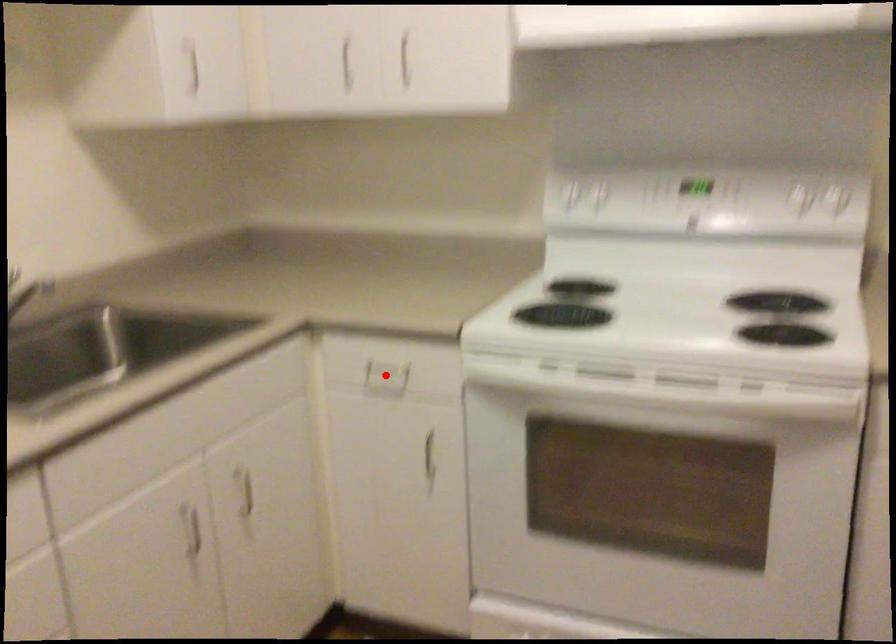
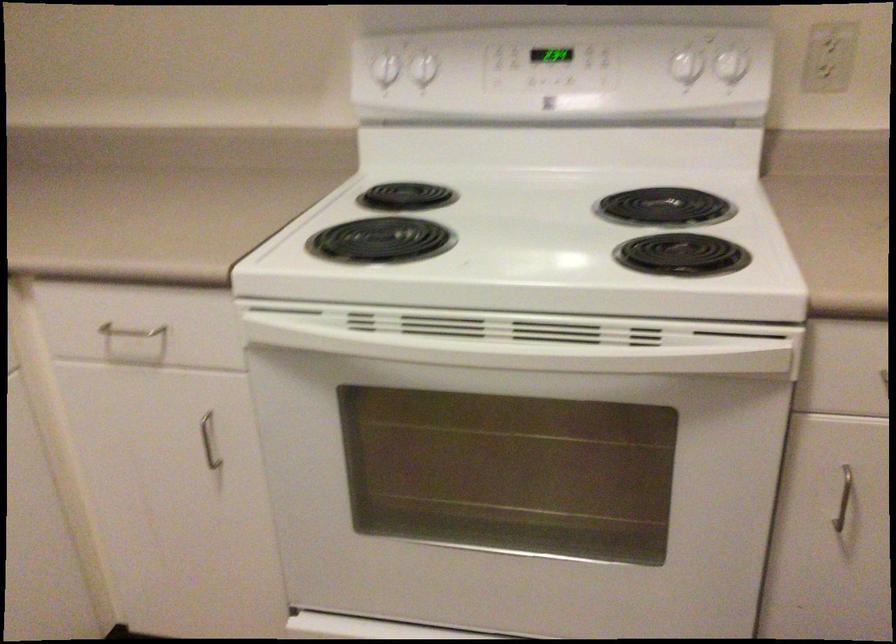
Where in the second image is the point corresponding to the highlighted location from the first image?

(136, 337)